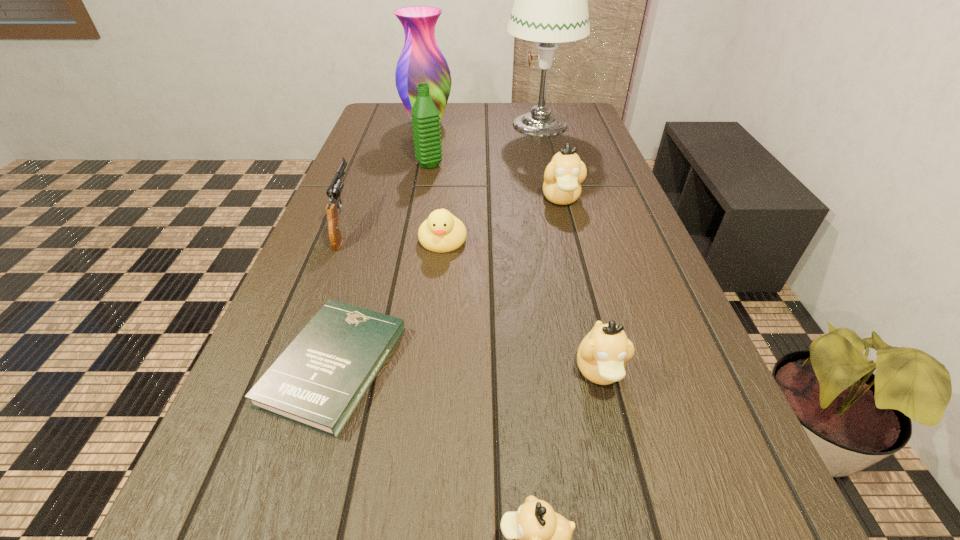
This screenshot has width=960, height=540. Find the location of `vacant area that satisfies the following two spatial constraints: 1. on the lampshade of the tallest object; 2. on the face of the third nearest duckling`. vacant area that satisfies the following two spatial constraints: 1. on the lampshade of the tallest object; 2. on the face of the third nearest duckling is located at coordinates (567, 240).

This screenshot has height=540, width=960. I want to click on vacant position in the image that satisfies the following two spatial constraints: 1. on the front side of the green water bottle; 2. on the right side of the eighth shortest object, so click(x=419, y=165).